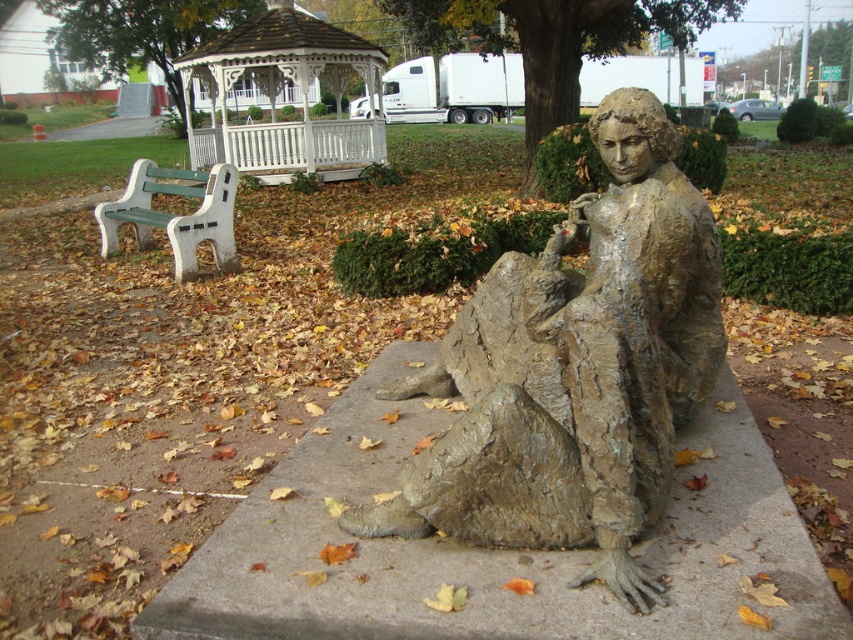
Can you confirm if rough concrete statue at center is shorter than white wood gazebo at upper center?

Indeed, rough concrete statue at center has a lesser height compared to white wood gazebo at upper center.

Is rough concrete statue at center to the right of white wood gazebo at upper center from the viewer's perspective?

Indeed, rough concrete statue at center is positioned on the right side of white wood gazebo at upper center.

I want to click on rough concrete statue at center, so click(495, 548).

You are a GUI agent. You are given a task and a screenshot of the screen. Output one action in this format:
    pyautogui.click(x=<x>, y=<y>)
    Task: Click on the rough concrete statue at center
    Image resolution: width=853 pixels, height=640 pixels.
    Given the screenshot: What is the action you would take?
    pyautogui.click(x=495, y=548)

Is bronze textured statue at center smaller than rough concrete statue at center?

No.

Can you confirm if bronze textured statue at center is wider than rough concrete statue at center?

No.

Identify the location of bronze textured statue at center. The width and height of the screenshot is (853, 640). (576, 369).

Locate an element on the screen. The width and height of the screenshot is (853, 640). bronze textured statue at center is located at coordinates click(576, 369).

Who is lower down, rough concrete statue at center or green plastic bench at left?

rough concrete statue at center is below.

Find the location of `rough concrete statue at center`. rough concrete statue at center is located at coordinates (495, 548).

Who is more forward, [397,600] or [149,221]?

Point [397,600] is more forward.

You are a GUI agent. You are given a task and a screenshot of the screen. Output one action in this format:
    pyautogui.click(x=<x>, y=<y>)
    Task: Click on the rough concrete statue at center
    The height and width of the screenshot is (640, 853).
    Given the screenshot: What is the action you would take?
    pyautogui.click(x=495, y=548)